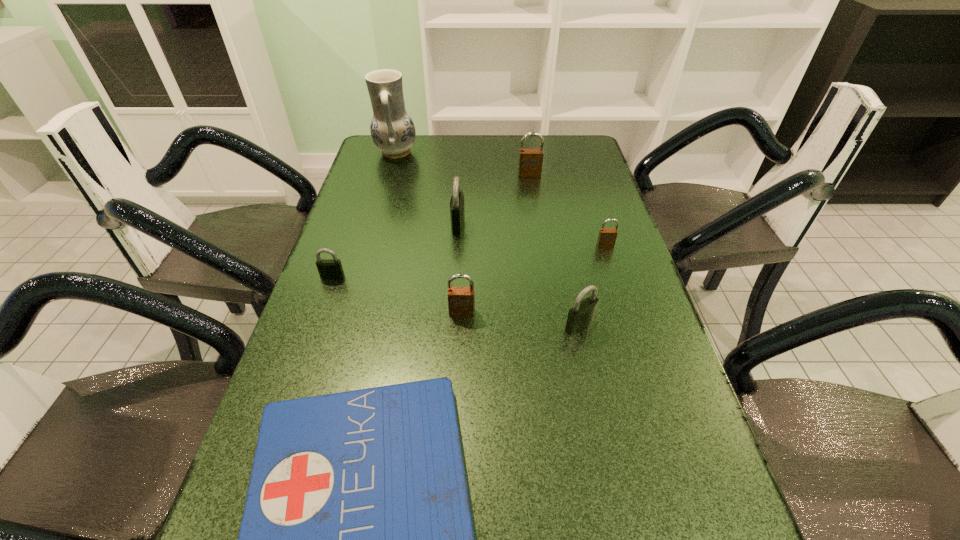
Find the location of a particular element. blue pottery is located at coordinates (393, 132).

This screenshot has width=960, height=540. I want to click on pottery, so click(393, 132).

Find the location of a particular element. the fifth nearest padlock is located at coordinates point(457,213).

This screenshot has width=960, height=540. I want to click on the third farthest object, so click(457, 213).

Locate an element on the screen. The image size is (960, 540). the seventh nearest object is located at coordinates (530, 160).

The width and height of the screenshot is (960, 540). In order to click on the farthest brown padlock in this screenshot , I will do (530, 160).

The height and width of the screenshot is (540, 960). I want to click on the nearest black padlock, so (x=581, y=315).

You are a GUI agent. You are given a task and a screenshot of the screen. Output one action in this format:
    pyautogui.click(x=<x>, y=<y>)
    Task: Click on the rightmost black padlock
    This screenshot has height=540, width=960.
    Given the screenshot: What is the action you would take?
    pyautogui.click(x=581, y=315)

You are a GUI agent. You are given a task and a screenshot of the screen. Output one action in this format:
    pyautogui.click(x=<x>, y=<y>)
    Task: Click on the leftmost brown padlock
    The image size is (960, 540).
    Given the screenshot: What is the action you would take?
    pyautogui.click(x=461, y=300)

At what (x,y) coordinates should I click in order to perform the action: click on the nearest brown padlock. Please return your answer as a coordinate pair (x, y). The height and width of the screenshot is (540, 960). Looking at the image, I should click on pos(461,300).